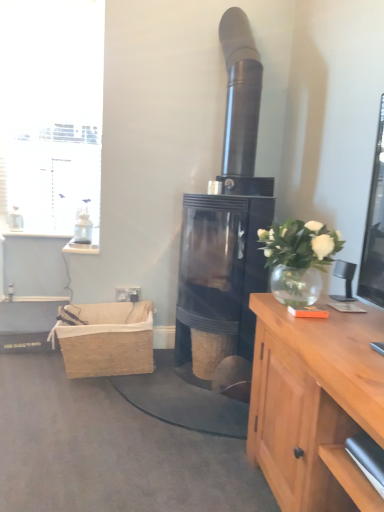
Question: Is the position of white glass vase at upper right more distant than that of burlap picnic basket at lower left?

Choices:
 (A) yes
 (B) no

Answer: (B)

Question: Can you confirm if white glass vase at upper right is taller than burlap picnic basket at lower left?

Choices:
 (A) yes
 (B) no

Answer: (B)

Question: Is burlap picnic basket at lower left surrounded by white glass vase at upper right?

Choices:
 (A) yes
 (B) no

Answer: (B)

Question: Is white glass vase at upper right in front of burlap picnic basket at lower left?

Choices:
 (A) yes
 (B) no

Answer: (A)

Question: Is white glass vase at upper right positioned far away from burlap picnic basket at lower left?

Choices:
 (A) no
 (B) yes

Answer: (B)

Question: Considering the positions of black glass fireplace at center and white glass window at upper left in the image, is black glass fireplace at center taller or shorter than white glass window at upper left?

Choices:
 (A) short
 (B) tall

Answer: (B)

Question: In the image, is black glass fireplace at center positioned in front of or behind white glass window at upper left?

Choices:
 (A) front
 (B) behind

Answer: (A)

Question: From a real-world perspective, is black glass fireplace at center physically located above or below white glass window at upper left?

Choices:
 (A) below
 (B) above

Answer: (A)

Question: From the image's perspective, is black glass fireplace at center located above or below white glass window at upper left?

Choices:
 (A) below
 (B) above

Answer: (A)

Question: Which is correct: woven brown basket at center is inside white glass window at upper left, or outside of it?

Choices:
 (A) inside
 (B) outside

Answer: (B)

Question: Relative to white glass window at upper left, is woven brown basket at center in front or behind?

Choices:
 (A) behind
 (B) front

Answer: (B)

Question: Considering the positions of woven brown basket at center and white glass window at upper left in the image, is woven brown basket at center wider or thinner than white glass window at upper left?

Choices:
 (A) thin
 (B) wide

Answer: (B)

Question: From a real-world perspective, relative to white glass window at upper left, is woven brown basket at center vertically above or below?

Choices:
 (A) below
 (B) above

Answer: (A)

Question: In terms of size, does white glass vase at upper right appear bigger or smaller than black glass fireplace at center?

Choices:
 (A) big
 (B) small

Answer: (B)

Question: Considering the positions of white glass vase at upper right and black glass fireplace at center in the image, is white glass vase at upper right taller or shorter than black glass fireplace at center?

Choices:
 (A) short
 (B) tall

Answer: (A)